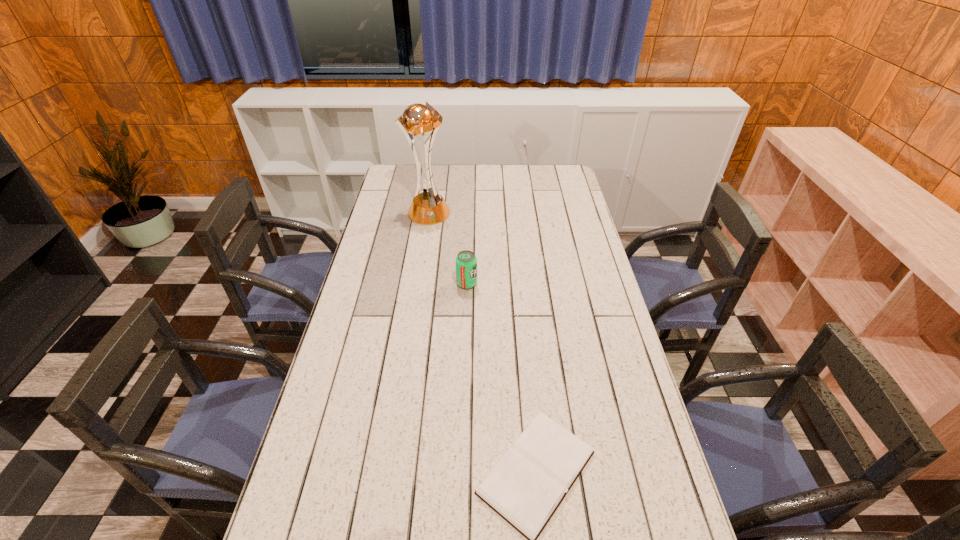
Identify the location of unoccupied area between the pop soda and the farthest object. (447, 248).

Find the location of a particular element. This screenshot has width=960, height=540. free space that is in between the second nearest object and the leftmost object is located at coordinates (447, 248).

Where is `empty space that is in between the trophy and the second tallest object`? empty space that is in between the trophy and the second tallest object is located at coordinates (447, 248).

The height and width of the screenshot is (540, 960). What are the coordinates of `free space that is in between the pop soda and the leftmost object` in the screenshot? It's located at (447, 248).

The image size is (960, 540). I want to click on free space between the leftmost object and the second shortest object, so click(x=447, y=248).

I want to click on object that stands as the closest to the pop soda, so click(427, 208).

Locate an element on the screen. object that is the closest to the second tallest object is located at coordinates (427, 208).